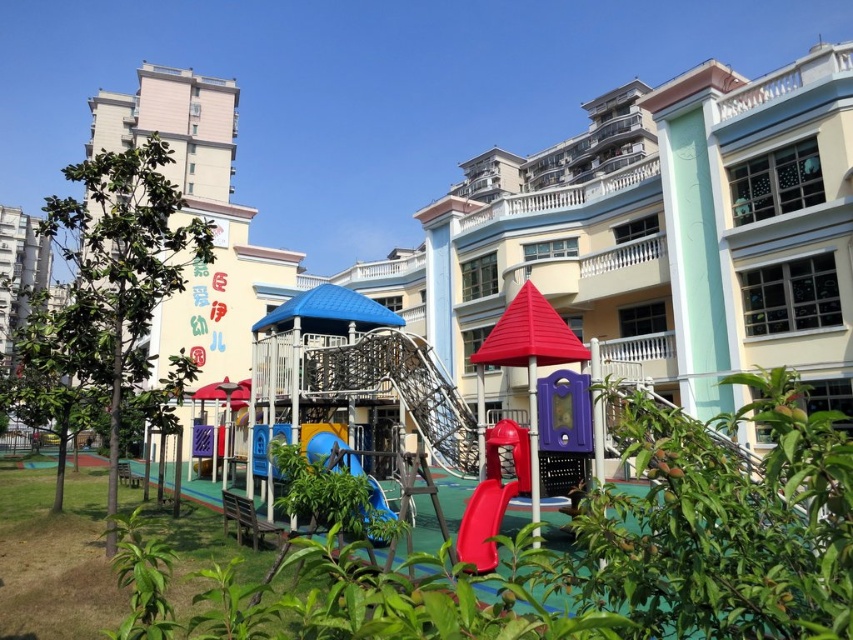
Question: Is rubber smooth slide at center thinner than blue rubber slide at center?

Choices:
 (A) no
 (B) yes

Answer: (B)

Question: Is rubber smooth slide at center wider than blue rubber slide at center?

Choices:
 (A) yes
 (B) no

Answer: (B)

Question: Is rubber smooth slide at center below blue rubber slide at center?

Choices:
 (A) yes
 (B) no

Answer: (A)

Question: Which of the following is the farthest from the observer?

Choices:
 (A) rubber smooth slide at center
 (B) blue rubber slide at center

Answer: (B)